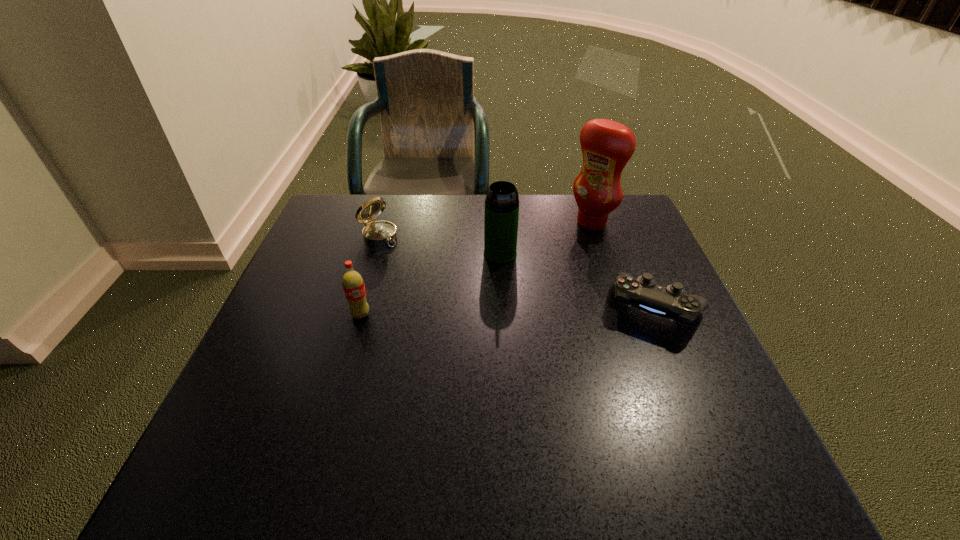
I want to click on vacant space at the far right corner of the desktop, so click(x=617, y=214).

Find the location of `free space between the third object from left to right and the compass`. free space between the third object from left to right and the compass is located at coordinates (440, 245).

At what (x,y) coordinates should I click in order to perform the action: click on vacant space that's between the soda and the second shortest object. Please return your answer as a coordinate pair (x, y). The image size is (960, 540). Looking at the image, I should click on (370, 275).

The image size is (960, 540). I want to click on free space that is in between the third object from left to right and the shortest object, so click(578, 281).

This screenshot has width=960, height=540. Identify the location of vacant area that lies between the shortest object and the soda. (508, 312).

Image resolution: width=960 pixels, height=540 pixels. In order to click on blank region between the shortest object and the soda in this screenshot , I will do `click(508, 312)`.

The image size is (960, 540). In order to click on empty space that is in between the third shortest object and the control in this screenshot , I will do `click(508, 312)`.

At what (x,y) coordinates should I click in order to perform the action: click on empty space that is in between the third object from left to right and the third shortest object. Please return your answer as a coordinate pair (x, y). The image size is (960, 540). Looking at the image, I should click on (430, 284).

Locate an element on the screen. The width and height of the screenshot is (960, 540). free space between the tallest object and the thermos bottle is located at coordinates (546, 238).

This screenshot has width=960, height=540. What are the coordinates of `free point between the condiment and the third shortest object` in the screenshot? It's located at (476, 268).